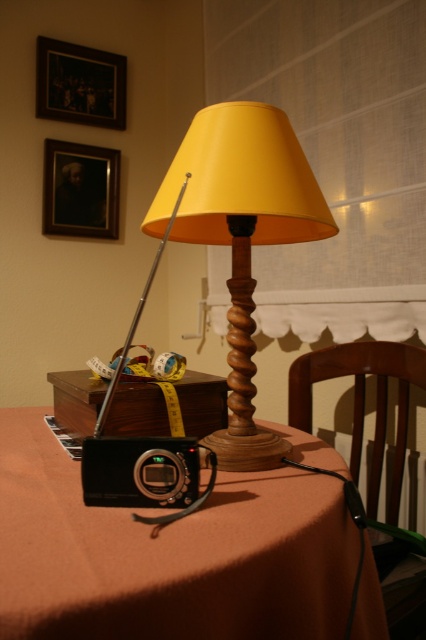
Question: Which object is positioned farthest from the wooden frame at upper left?

Choices:
 (A) matte black portrait at upper left
 (B) yellow matte wood table lamp at center
 (C) orange fabric table at lower center

Answer: (C)

Question: Can you confirm if orange fabric table at lower center is positioned above matte black portrait at upper left?

Choices:
 (A) no
 (B) yes

Answer: (A)

Question: From the image, what is the correct spatial relationship of orange fabric table at lower center in relation to yellow matte wood table lamp at center?

Choices:
 (A) above
 (B) below

Answer: (B)

Question: Which object is closer to the camera taking this photo?

Choices:
 (A) orange fabric table at lower center
 (B) yellow matte wood table lamp at center
 (C) matte black portrait at upper left

Answer: (A)

Question: Which point is farther from the camera taking this photo?

Choices:
 (A) (48, 529)
 (B) (40, 42)
 (C) (249, 234)

Answer: (B)

Question: Is orange fabric table at lower center to the left of matte black portrait at upper left from the viewer's perspective?

Choices:
 (A) no
 (B) yes

Answer: (A)